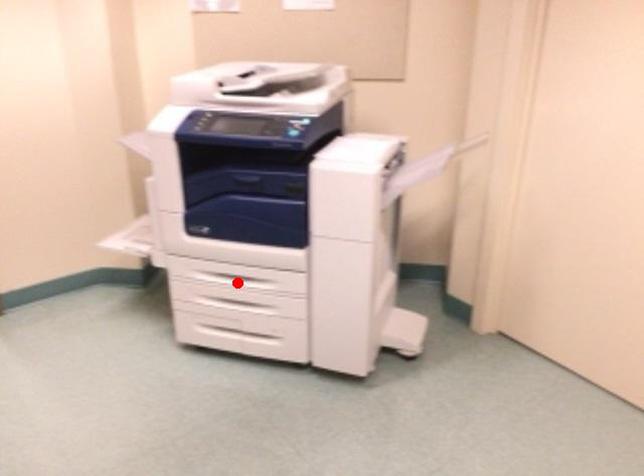
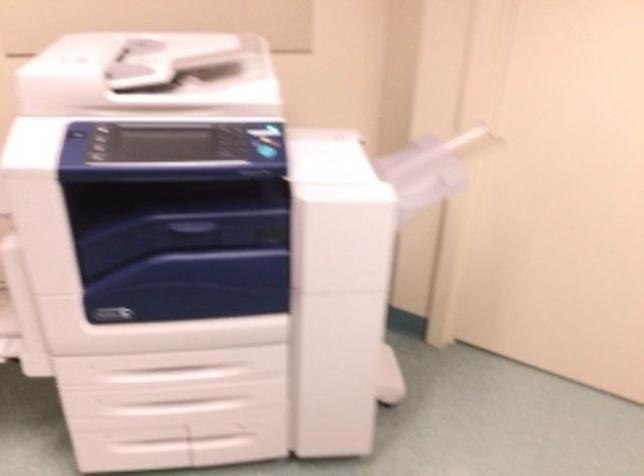
In the second image, find the point that corresponds to the highlighted location in the first image.

(176, 373)